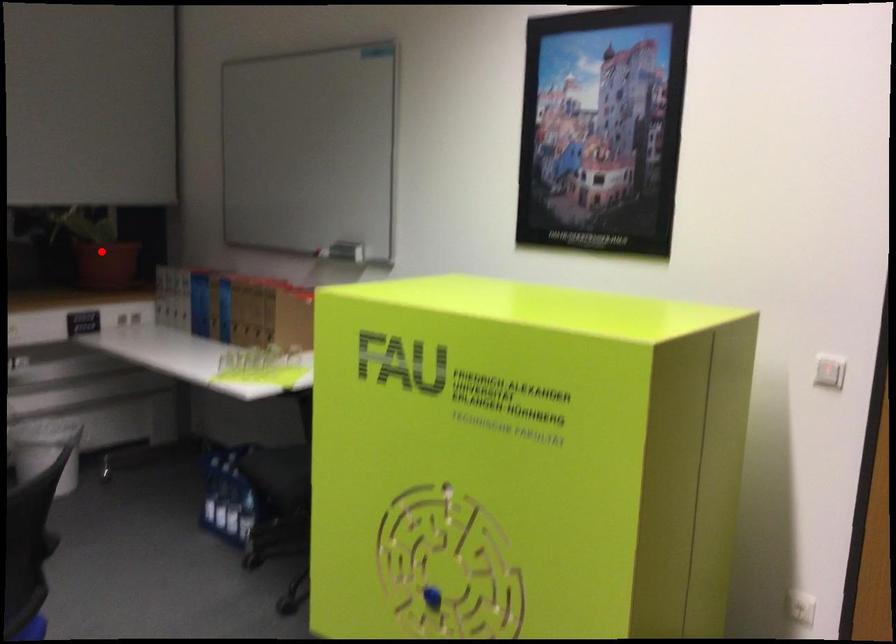
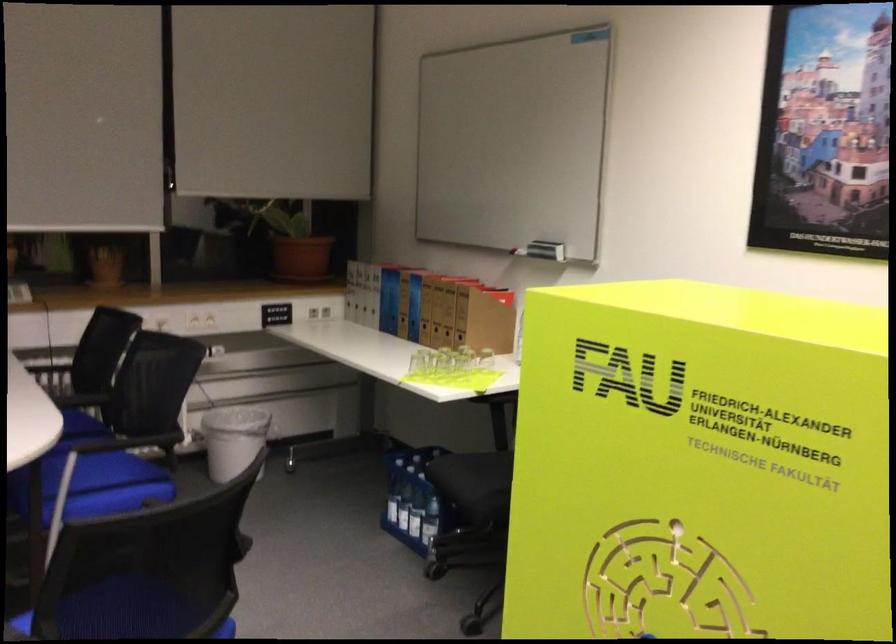
Locate, in the second image, the point that corresponds to the highlighted location in the first image.

(294, 243)